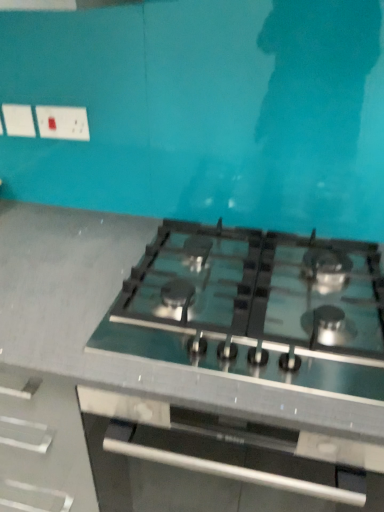
Question: Is satin black gas stove at center not within white plastic socket at upper left?

Choices:
 (A) yes
 (B) no

Answer: (A)

Question: Could you tell me if satin black gas stove at center is turned towards white plastic socket at upper left?

Choices:
 (A) yes
 (B) no

Answer: (B)

Question: Is satin black gas stove at center shorter than white plastic socket at upper left?

Choices:
 (A) no
 (B) yes

Answer: (B)

Question: Is satin black gas stove at center next to white plastic socket at upper left and touching it?

Choices:
 (A) no
 (B) yes

Answer: (A)

Question: Can you confirm if satin black gas stove at center is positioned to the left of white plastic socket at upper left?

Choices:
 (A) yes
 (B) no

Answer: (B)

Question: Considering the positions of green glass stove at center and satin black gas stove at center in the image, is green glass stove at center taller or shorter than satin black gas stove at center?

Choices:
 (A) tall
 (B) short

Answer: (A)

Question: Considering the positions of point (115, 409) and point (158, 237), is point (115, 409) closer or farther from the camera than point (158, 237)?

Choices:
 (A) farther
 (B) closer

Answer: (B)

Question: Do you think green glass stove at center is within satin black gas stove at center, or outside of it?

Choices:
 (A) outside
 (B) inside

Answer: (A)

Question: Is green glass stove at center in front of or behind satin black gas stove at center in the image?

Choices:
 (A) behind
 (B) front

Answer: (B)

Question: In terms of width, does satin black gas stove at center look wider or thinner when compared to white plastic socket at upper left?

Choices:
 (A) wide
 (B) thin

Answer: (A)

Question: In terms of height, does satin black gas stove at center look taller or shorter compared to white plastic socket at upper left?

Choices:
 (A) tall
 (B) short

Answer: (B)

Question: Is satin black gas stove at center in front of or behind white plastic socket at upper left in the image?

Choices:
 (A) front
 (B) behind

Answer: (A)

Question: Considering the positions of satin black gas stove at center and white plastic socket at upper left in the image, is satin black gas stove at center bigger or smaller than white plastic socket at upper left?

Choices:
 (A) small
 (B) big

Answer: (B)

Question: Is point (89, 138) closer or farther from the camera than point (46, 246)?

Choices:
 (A) closer
 (B) farther

Answer: (B)

Question: From the image's perspective, is white plastic socket at upper left positioned above or below green glass stove at center?

Choices:
 (A) below
 (B) above

Answer: (B)